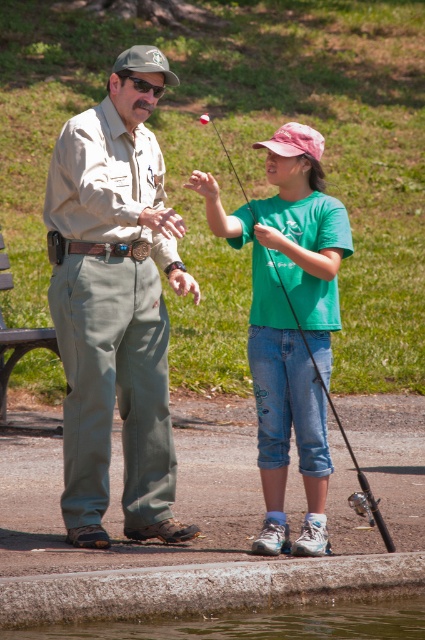
You are standing at the point with coordinates point (282,621). You want to walk to the point with coordinates point (368,496). Which direction should you move?

You should move backward because point (282,621) is in front of point (368,496).

You are standing at the edge of the water and want to pick up the black plastic fishing pole at center. Is the greenish water at lower center between you and the fishing pole?

Yes, the greenish water at lower center is between you and the black plastic fishing pole at center because the greenish water at lower center is in front of the black plastic fishing pole at center.